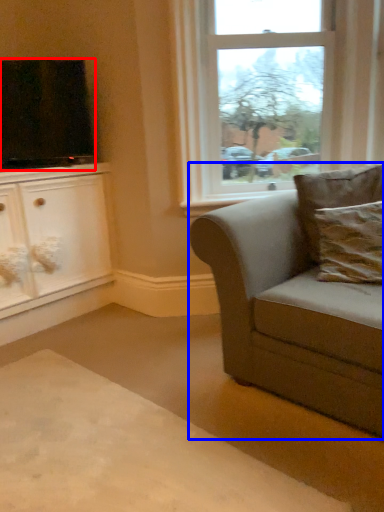
Question: Among these objects, which one is nearest to the camera, television (highlighted by a red box) or studio couch (highlighted by a blue box)?

Choices:
 (A) television
 (B) studio couch

Answer: (B)